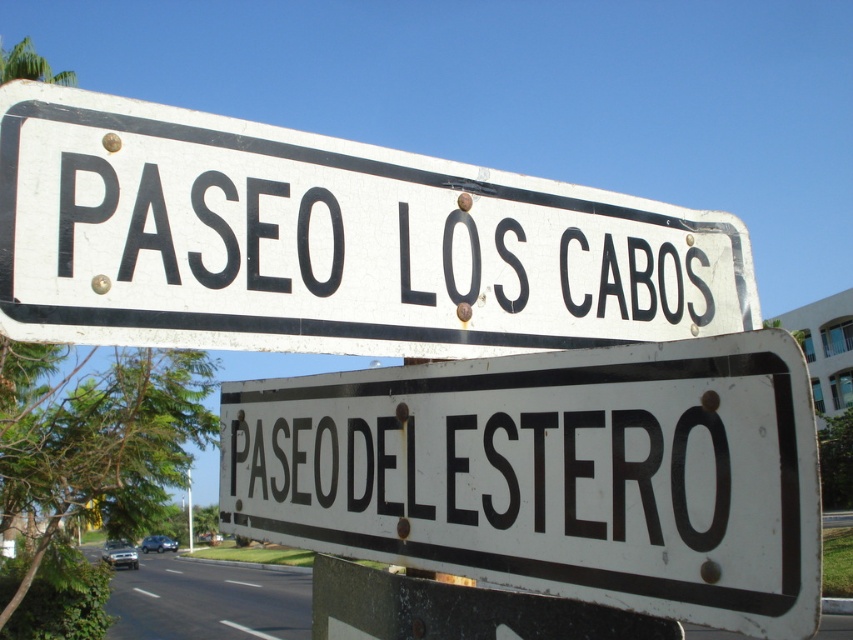
Question: Which of these objects is positioned farthest from the white matte street sign at upper center?

Choices:
 (A) white matte sign at center
 (B) white matte/black lettering at center
 (C) white plastic pole at upper center

Answer: (C)

Question: Which of the following is the farthest from the observer?

Choices:
 (A) (189, 529)
 (B) (561, 320)
 (C) (222, 428)

Answer: (A)

Question: Is white matte street sign at upper center to the left of white plastic pole at upper center from the viewer's perspective?

Choices:
 (A) yes
 (B) no

Answer: (B)

Question: Which point appears farthest from the camera in this image?

Choices:
 (A) (595, 596)
 (B) (190, 540)
 (C) (12, 230)
 (D) (398, 493)

Answer: (B)

Question: Is white matte street sign at upper center above white matte/black lettering at center?

Choices:
 (A) yes
 (B) no

Answer: (A)

Question: Is white matte/black lettering at center above white plastic pole at upper center?

Choices:
 (A) yes
 (B) no

Answer: (A)